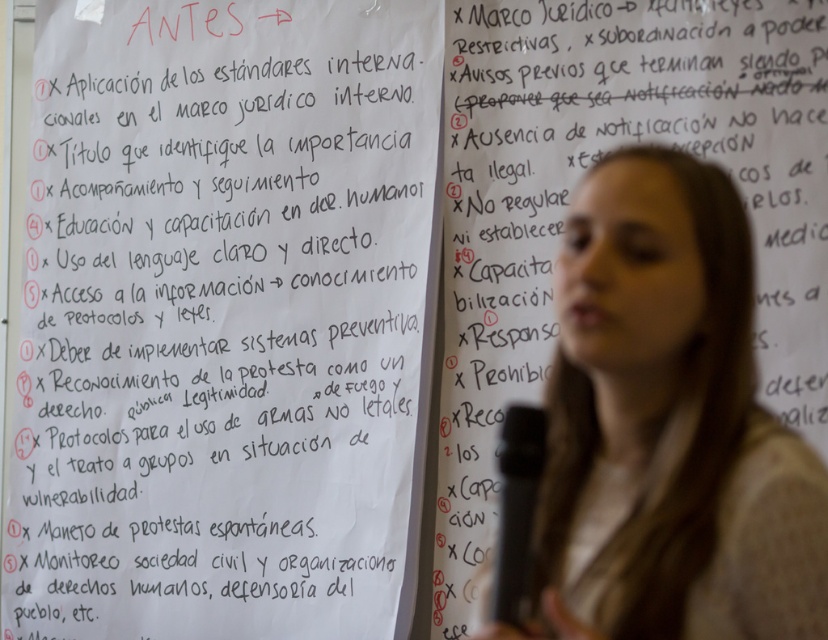
You are a photographer who wants to adjust the focus to capture the black plastic microphone at lower center without blurring the blonde hair at center. Is this possible given their positions?

The blonde hair at center is in front of the black plastic microphone at lower center, so adjusting the focus to clearly capture the microphone while keeping the hair in focus may not be possible due to their overlapping positions.

You are a student attending a presentation and need to take notes. You see a white paper at upper left and blonde hair at center. Which object is larger in size?

The white paper at upper left is bigger than blonde hair at center.

You are a photographer adjusting your camera settings to focus on two points in the image, point (215,106) and point (518,625). Since the person is slightly out of focus, you need to refocus. Which point should you focus on first to ensure the closest object is sharp?

Point (215,106) is further to the camera than point (518,625), so you should focus on point (215,106) first to ensure the closest object is sharp.